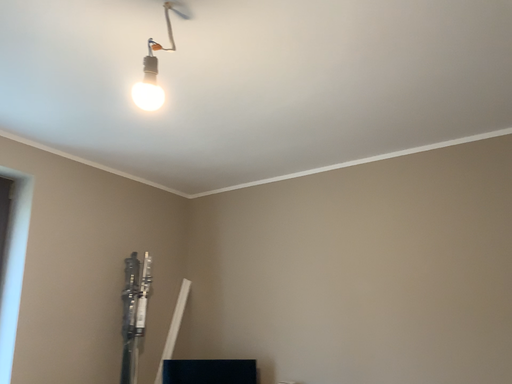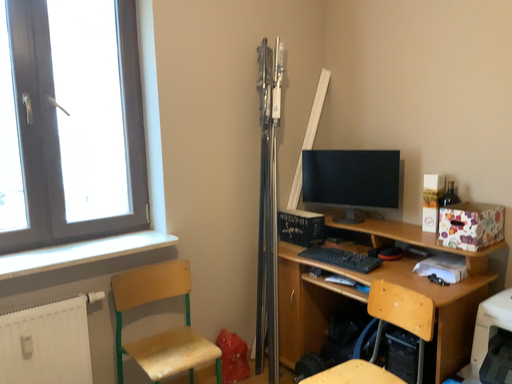
Question: Which way did the camera rotate in the video?

Choices:
 (A) rotated right
 (B) rotated left

Answer: (B)